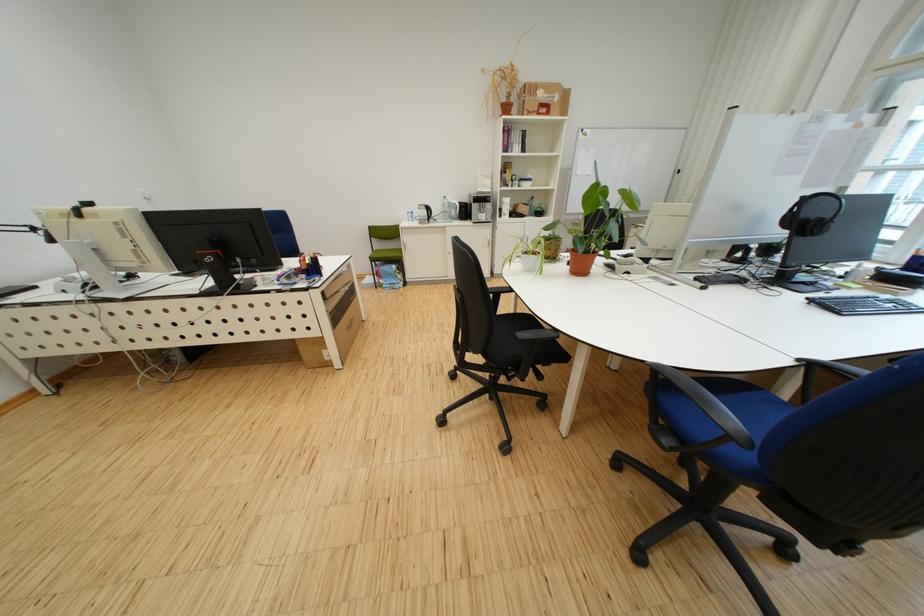
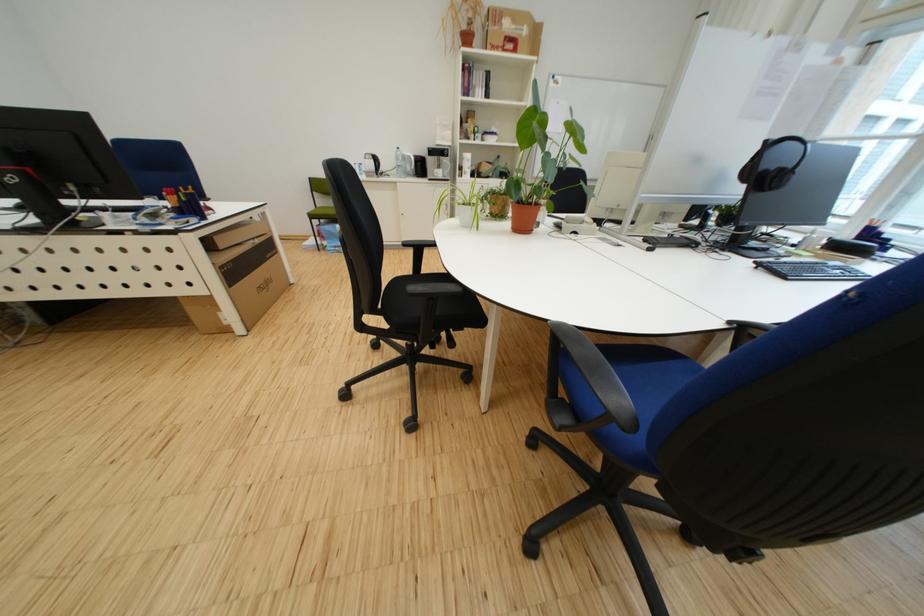
Question: I am providing you with two images of the same scene from different viewpoints. Which of the following objects are not visible in image2?

Choices:
 (A) black headphones
 (B) cardboard box
 (C) blue chair armrest
 (D) none of these

Answer: (D)